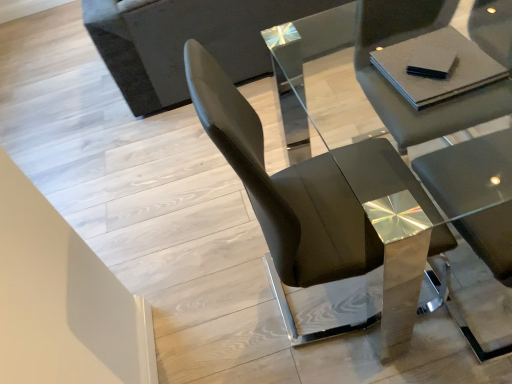
Question: Can you confirm if matte gray chair at center, arranged as the 1th chair when viewed from the right, is wider than dark gray fabric couch at upper left?

Choices:
 (A) no
 (B) yes

Answer: (A)

Question: Is matte gray chair at center, arranged as the 1th chair when viewed from the right, outside of dark gray fabric couch at upper left?

Choices:
 (A) no
 (B) yes

Answer: (B)

Question: Is matte gray chair at center, arranged as the 1th chair when viewed from the right, positioned with its back to dark gray fabric couch at upper left?

Choices:
 (A) no
 (B) yes

Answer: (B)

Question: Is matte gray chair at center, arranged as the 1th chair when viewed from the right, further to camera compared to dark gray fabric couch at upper left?

Choices:
 (A) yes
 (B) no

Answer: (B)

Question: Is there a large distance between matte gray chair at center, the second chair in the left-to-right sequence, and dark gray fabric couch at upper left?

Choices:
 (A) no
 (B) yes

Answer: (B)

Question: Does matte gray chair at center, the second chair in the left-to-right sequence, have a larger size compared to dark gray fabric couch at upper left?

Choices:
 (A) yes
 (B) no

Answer: (B)

Question: Is glossy black chair at center, the second chair from the right, not inside dark gray fabric couch at upper left?

Choices:
 (A) no
 (B) yes

Answer: (B)

Question: Does glossy black chair at center, the second chair from the right, have a lesser height compared to dark gray fabric couch at upper left?

Choices:
 (A) no
 (B) yes

Answer: (A)

Question: Is glossy black chair at center, the second chair from the right, positioned behind dark gray fabric couch at upper left?

Choices:
 (A) no
 (B) yes

Answer: (A)

Question: Is glossy black chair at center, the second chair from the right, in front of dark gray fabric couch at upper left?

Choices:
 (A) yes
 (B) no

Answer: (A)

Question: Does glossy black chair at center, which appears as the 1th chair when viewed from the left, contain dark gray fabric couch at upper left?

Choices:
 (A) no
 (B) yes

Answer: (A)

Question: Could you tell me if glossy black chair at center, which appears as the 1th chair when viewed from the left, is facing dark gray fabric couch at upper left?

Choices:
 (A) no
 (B) yes

Answer: (A)

Question: Is the depth of matte gray chair at center, the second chair in the left-to-right sequence, less than that of glossy black chair at center, the second chair from the right?

Choices:
 (A) yes
 (B) no

Answer: (B)